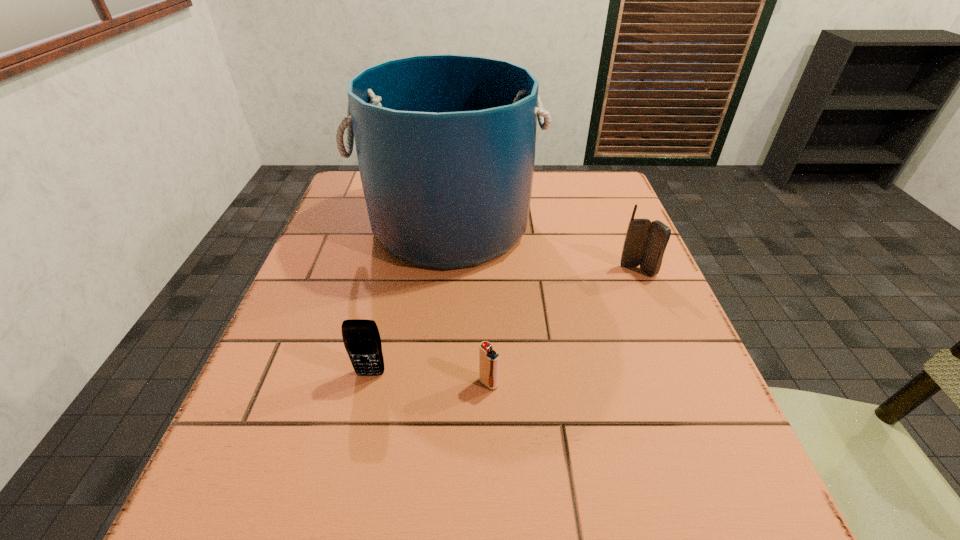
Select which object is the second closest to the igniter. Please provide its 2D coordinates. Your answer should be formatted as a tuple, i.e. [(x, y)], where the tuple contains the x and y coordinates of a point satisfying the conditions above.

[(445, 143)]

Identify the location of free spot that satisfies the following two spatial constraints: 1. on the screen of the igniter; 2. on the left side of the shorter cellular telephone. (369, 383).